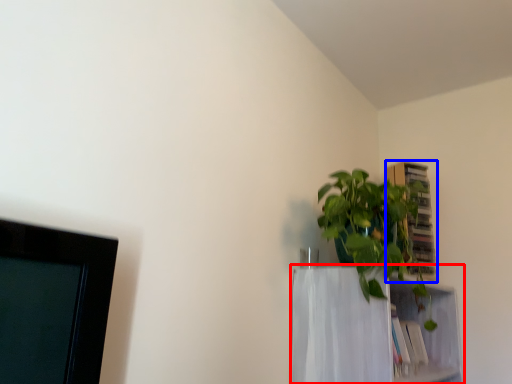
Question: Which object appears closest to the camera in this image, shelf (highlighted by a red box) or cabinet (highlighted by a blue box)?

Choices:
 (A) shelf
 (B) cabinet

Answer: (A)